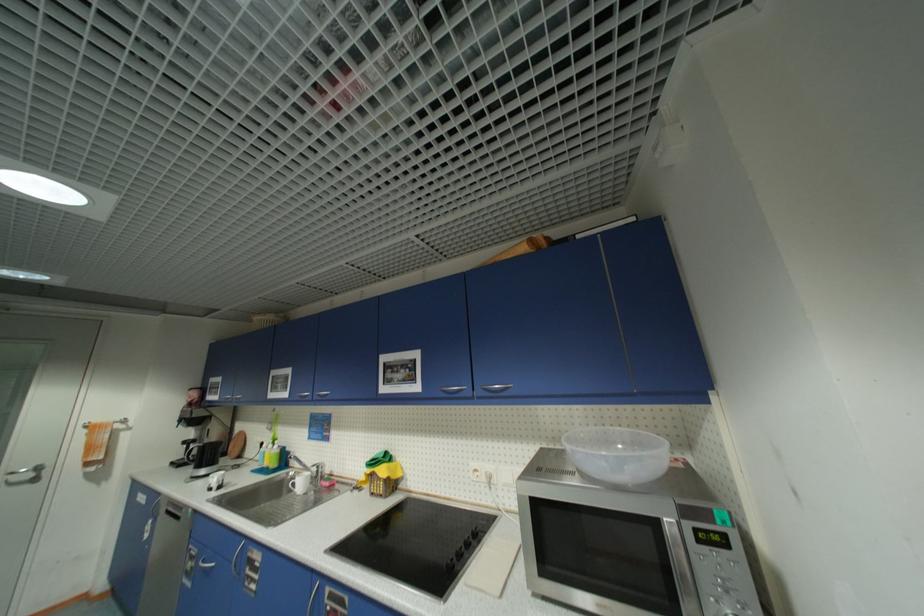
Describe the element at coordinates (192, 453) in the screenshot. The height and width of the screenshot is (616, 924). I see `the black coffee pot handle` at that location.